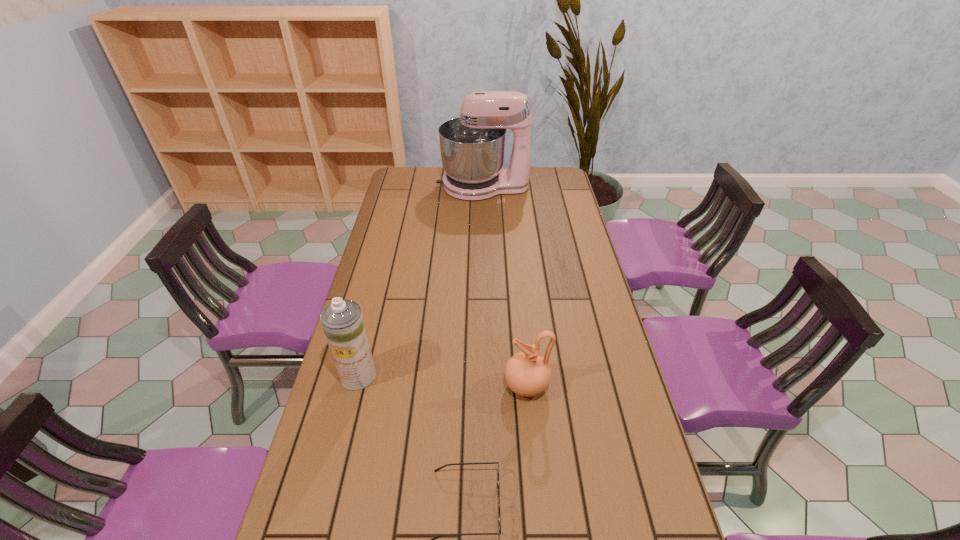
Image resolution: width=960 pixels, height=540 pixels. I want to click on vacant space located on the spout of the pottery, so click(x=377, y=386).

Locate an element on the screen. The height and width of the screenshot is (540, 960). free spot located on the spout of the pottery is located at coordinates (486, 386).

Image resolution: width=960 pixels, height=540 pixels. I want to click on object at the far edge, so click(472, 146).

The image size is (960, 540). What are the coordinates of `object at the left edge` in the screenshot? It's located at (342, 321).

Identify the location of free space at the right edge. The width and height of the screenshot is (960, 540). (653, 488).

Image resolution: width=960 pixels, height=540 pixels. Find the location of `vacant space at the far left corner of the desktop`. vacant space at the far left corner of the desktop is located at coordinates (400, 185).

This screenshot has height=540, width=960. I want to click on vacant space in between the aerosol can and the farthest object, so click(420, 281).

Find the location of a particular element. The width and height of the screenshot is (960, 540). unoccupied area between the farthest object and the leftmost object is located at coordinates (420, 281).

The height and width of the screenshot is (540, 960). I want to click on unoccupied position between the pottery and the farthest object, so click(x=504, y=286).

This screenshot has height=540, width=960. In order to click on vacant area that lies between the second tallest object and the third tallest object in this screenshot , I will do `click(443, 380)`.